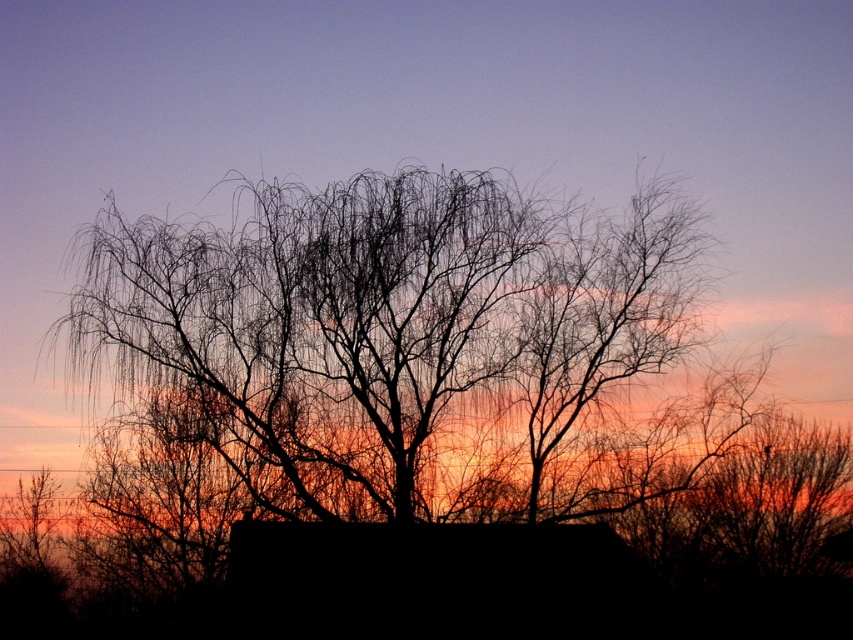
Does point (608, 486) come closer to viewer compared to point (566, 556)?

No, (608, 486) is further to viewer.

Between silhouette branches at center and black matte hut at center, which one has more height?

silhouette branches at center

From the picture: Who is more distant from viewer, (732, 499) or (361, 621)?

Point (732, 499)

In order to click on silhouette branches at center in this screenshot , I will do `click(428, 381)`.